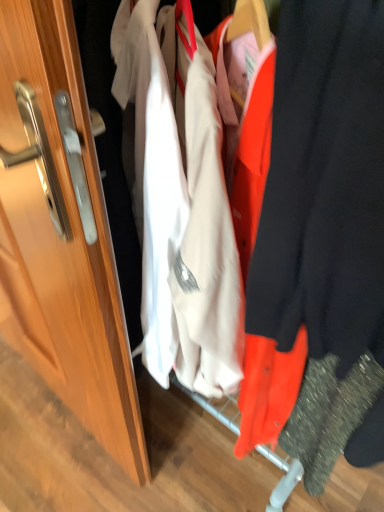
Locate an element on the screen. This screenshot has height=512, width=384. vacant area situated below wooden door at left (from a real-world perspective) is located at coordinates tap(58, 407).